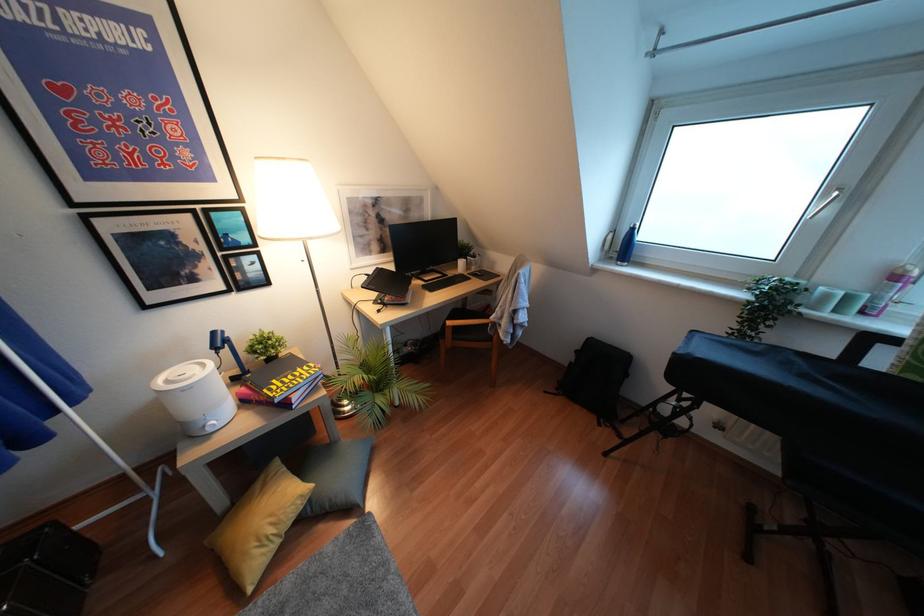
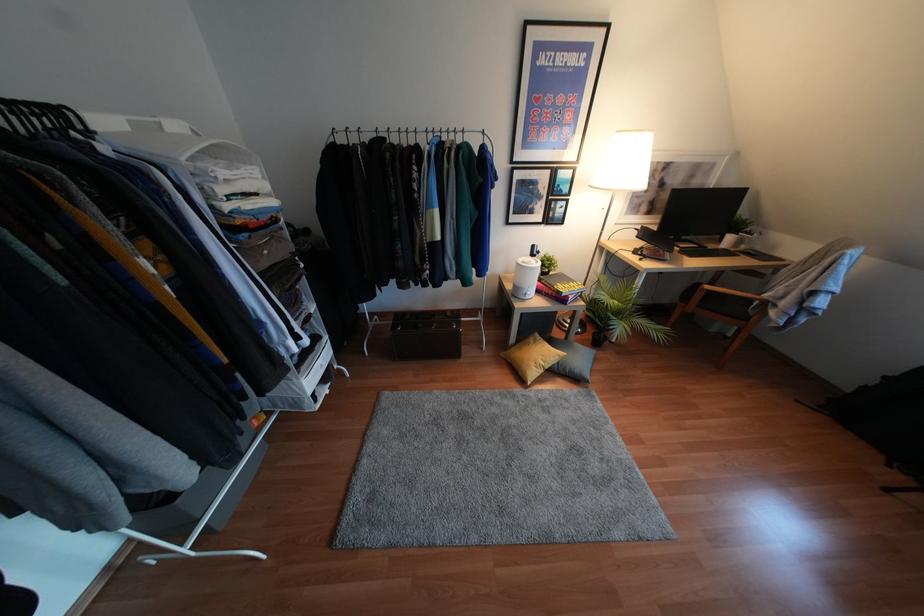
Locate, in the second image, the point that corresponds to (x=298, y=370) in the first image.

(570, 283)